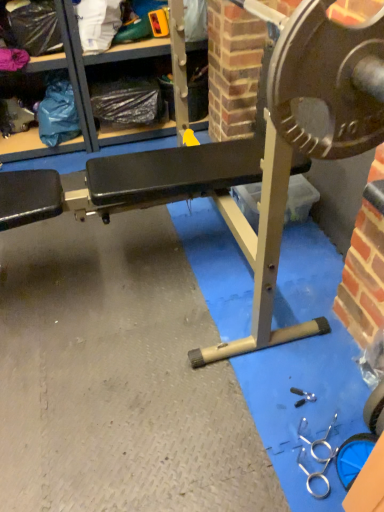
Question: Considering the positions of metallic black bench at center and metallic gray shelf at upper center in the image, is metallic black bench at center bigger or smaller than metallic gray shelf at upper center?

Choices:
 (A) big
 (B) small

Answer: (B)

Question: From a real-world perspective, is metallic black bench at center above or below metallic gray shelf at upper center?

Choices:
 (A) below
 (B) above

Answer: (B)

Question: Is metallic black bench at center wider or thinner than metallic gray shelf at upper center?

Choices:
 (A) wide
 (B) thin

Answer: (B)

Question: In terms of width, does metallic gray shelf at upper center look wider or thinner when compared to metallic black bench at center?

Choices:
 (A) thin
 (B) wide

Answer: (B)

Question: Is point (67, 13) positioned closer to the camera than point (274, 55)?

Choices:
 (A) farther
 (B) closer

Answer: (A)

Question: Looking at the image, does metallic gray shelf at upper center seem bigger or smaller compared to metallic black bench at center?

Choices:
 (A) small
 (B) big

Answer: (B)

Question: From the image's perspective, relative to metallic black bench at center, is metallic gray shelf at upper center above or below?

Choices:
 (A) above
 (B) below

Answer: (A)